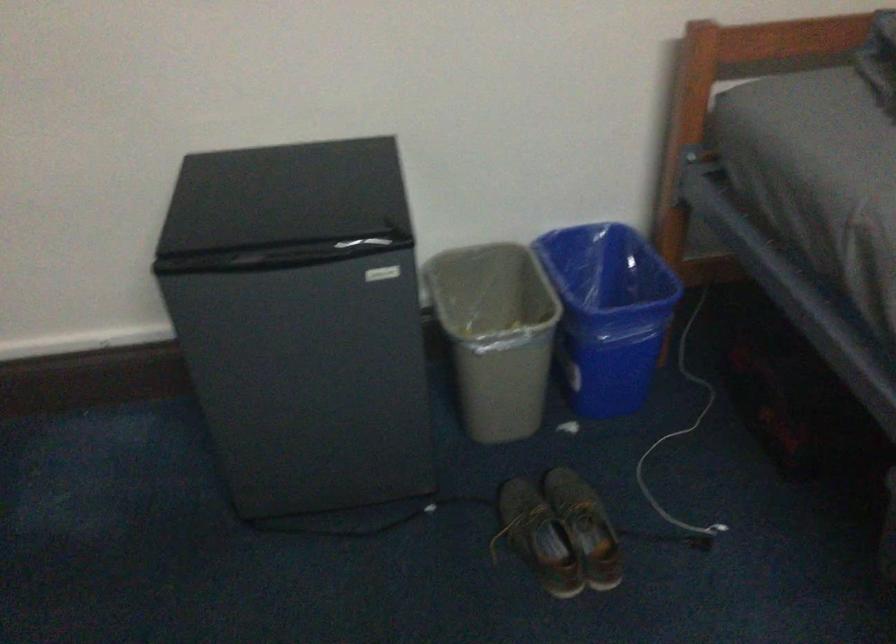
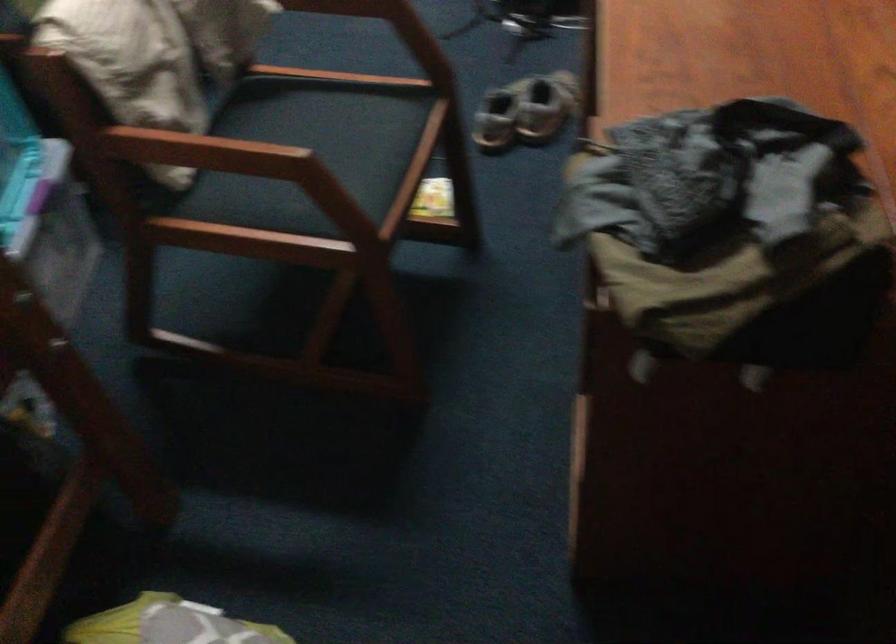
What movement of the cameraman would produce the second image?

The movement direction of the cameraman is right, backward.